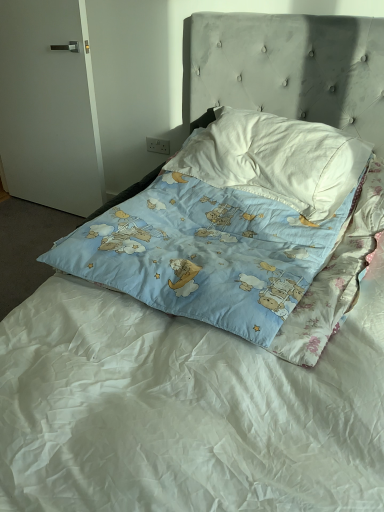
Question: From the image's perspective, is white matte door at left above white cotton pillow at upper center, the first pillow when ordered from top to bottom?

Choices:
 (A) yes
 (B) no

Answer: (A)

Question: Is white matte door at left aimed at white cotton pillow at upper center, positioned as the 2th pillow in bottom-to-top order?

Choices:
 (A) yes
 (B) no

Answer: (B)

Question: Considering the relative positions of white matte door at left and white cotton pillow at upper center, positioned as the 2th pillow in bottom-to-top order, in the image provided, is white matte door at left behind white cotton pillow at upper center, positioned as the 2th pillow in bottom-to-top order,?

Choices:
 (A) no
 (B) yes

Answer: (B)

Question: Is white matte door at left at the right side of white cotton pillow at upper center, positioned as the 2th pillow in bottom-to-top order?

Choices:
 (A) no
 (B) yes

Answer: (A)

Question: Is white matte door at left taller than white cotton pillow at upper center, the first pillow when ordered from top to bottom?

Choices:
 (A) yes
 (B) no

Answer: (A)

Question: Does point (362, 143) appear closer or farther from the camera than point (147, 190)?

Choices:
 (A) farther
 (B) closer

Answer: (A)

Question: In terms of height, does white cotton pillow at upper center, the first pillow when ordered from top to bottom, look taller or shorter compared to blue cotton pillow at center, which ranks as the first pillow in bottom-to-top order?

Choices:
 (A) short
 (B) tall

Answer: (A)

Question: Considering their positions, is white cotton pillow at upper center, positioned as the 2th pillow in bottom-to-top order, located in front of or behind blue cotton pillow at center, which ranks as the first pillow in bottom-to-top order?

Choices:
 (A) behind
 (B) front

Answer: (A)

Question: Is white cotton pillow at upper center, positioned as the 2th pillow in bottom-to-top order, wider or thinner than blue cotton pillow at center, which ranks as the first pillow in bottom-to-top order?

Choices:
 (A) thin
 (B) wide

Answer: (A)

Question: Is point 208,267 positioned closer to the camera than point 319,139?

Choices:
 (A) closer
 (B) farther

Answer: (A)

Question: Considering the positions of blue cotton pillow at center, the 2th pillow positioned from the top, and white cotton pillow at upper center, positioned as the 2th pillow in bottom-to-top order, in the image, is blue cotton pillow at center, the 2th pillow positioned from the top, taller or shorter than white cotton pillow at upper center, positioned as the 2th pillow in bottom-to-top order,?

Choices:
 (A) short
 (B) tall

Answer: (B)

Question: From the image's perspective, is blue cotton pillow at center, which ranks as the first pillow in bottom-to-top order, above or below white cotton pillow at upper center, the first pillow when ordered from top to bottom?

Choices:
 (A) below
 (B) above

Answer: (A)

Question: From a real-world perspective, is blue cotton pillow at center, which ranks as the first pillow in bottom-to-top order, above or below white cotton pillow at upper center, the first pillow when ordered from top to bottom?

Choices:
 (A) above
 (B) below

Answer: (B)

Question: Considering the positions of blue cotton pillow at center, which ranks as the first pillow in bottom-to-top order, and white matte door at left in the image, is blue cotton pillow at center, which ranks as the first pillow in bottom-to-top order, wider or thinner than white matte door at left?

Choices:
 (A) thin
 (B) wide

Answer: (B)

Question: Is blue cotton pillow at center, which ranks as the first pillow in bottom-to-top order, in front of or behind white matte door at left in the image?

Choices:
 (A) behind
 (B) front

Answer: (B)